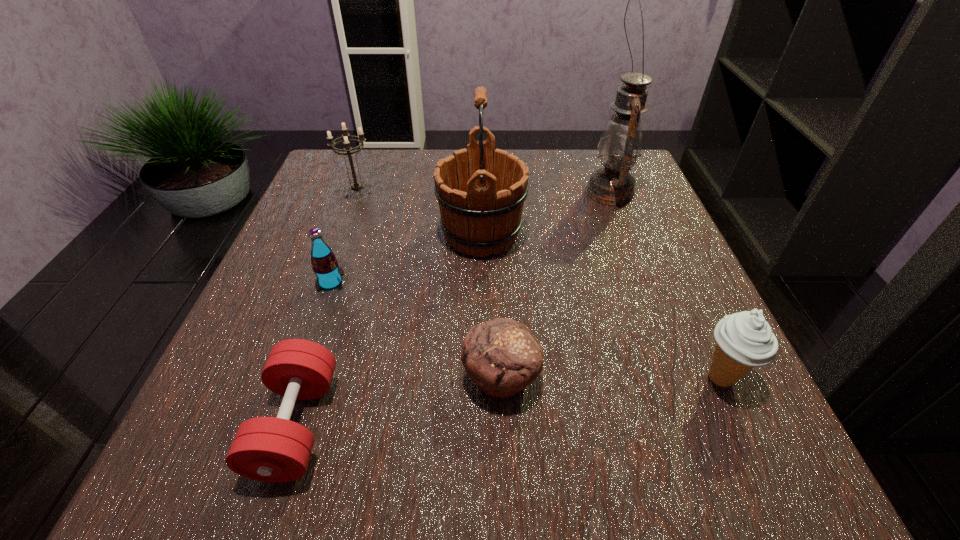
In order to click on the tallest object in this screenshot , I will do `click(620, 145)`.

Where is `wine bucket`? This screenshot has width=960, height=540. wine bucket is located at coordinates (481, 191).

You are a GUI agent. You are given a task and a screenshot of the screen. Output one action in this format:
    pyautogui.click(x=<x>, y=<y>)
    Task: Click on the candle holder
    The height and width of the screenshot is (540, 960).
    Given the screenshot: What is the action you would take?
    pyautogui.click(x=356, y=186)

I want to click on icecream, so click(745, 340).

Locate an element on the screen. the fourth nearest object is located at coordinates (329, 275).

What are the coordinates of `muffin` in the screenshot? It's located at (502, 356).

The height and width of the screenshot is (540, 960). What are the coordinates of `dumbbell` in the screenshot? It's located at (269, 449).

The height and width of the screenshot is (540, 960). In order to click on free space located on the left of the tallest object in this screenshot , I will do `click(476, 192)`.

Image resolution: width=960 pixels, height=540 pixels. In order to click on free space located 0.340m on the front of the wine bucket in this screenshot , I will do `click(482, 438)`.

Locate an element on the screen. vacant space situated 0.260m on the right of the candle holder is located at coordinates (490, 194).